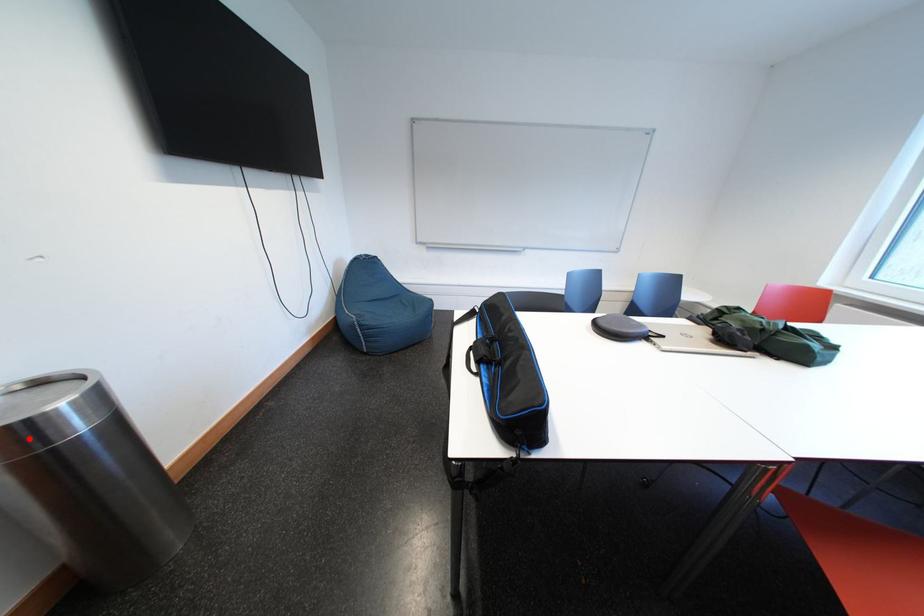
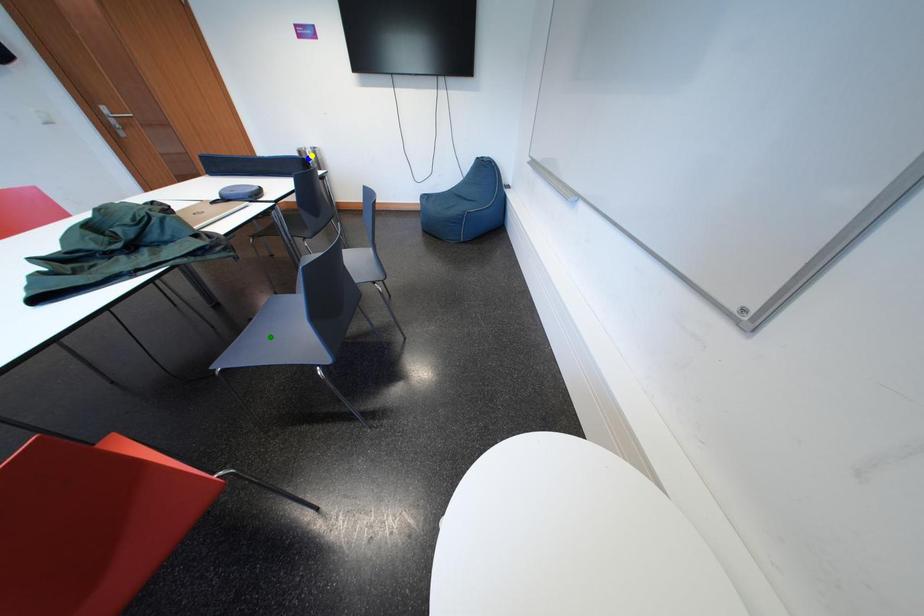
Question: I am providing you with two images of the same scene from different viewpoints. A red point is marked on the first image. You are given multiple points on the second image. Which point in image 2 is actually the same real-world point as the red point in image 1?

Choices:
 (A) blue point
 (B) green point
 (C) yellow point

Answer: (A)